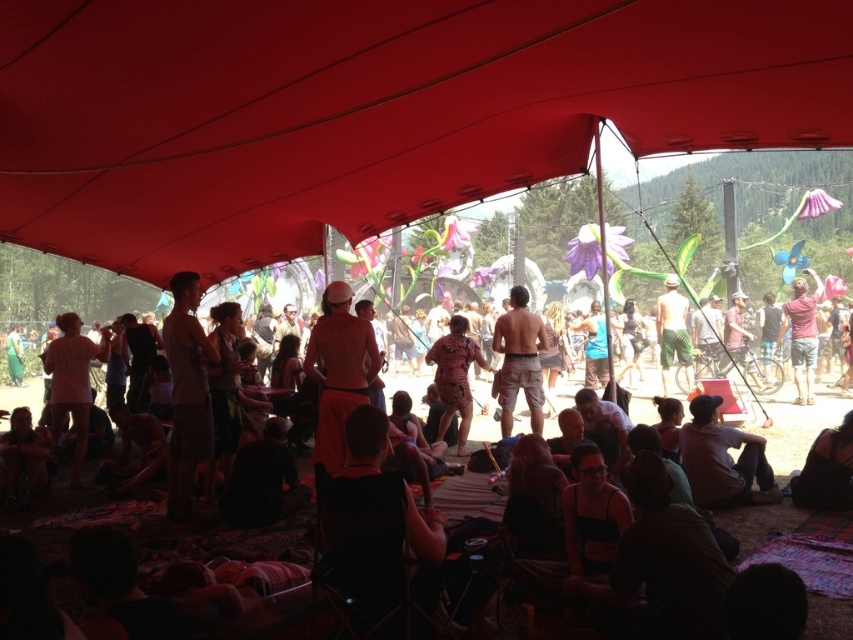
Which of these two, light brown fabric shorts at center or wooden painted figure at center, stands taller?

Standing taller between the two is light brown fabric shorts at center.

Who is more forward, [170,454] or [453,413]?

Point [170,454]

Where is `light brown fabric shorts at center`? light brown fabric shorts at center is located at coordinates (187, 394).

Can you confirm if orange fabric skirt at center is smaller than wooden painted figure at center?

No.

Does point (329, 314) come closer to viewer compared to point (459, 444)?

Yes, point (329, 314) is in front of point (459, 444).

At what (x,y) coordinates should I click in order to perform the action: click on orange fabric skirt at center. Please return your answer as a coordinate pair (x, y). This screenshot has height=640, width=853. Looking at the image, I should click on (338, 371).

Who is lower down, light brown fabric shorts at center or orange fabric skirt at center?

orange fabric skirt at center is below.

Between light brown fabric shorts at center and orange fabric skirt at center, which one has less height?

orange fabric skirt at center is shorter.

The image size is (853, 640). What are the coordinates of `light brown fabric shorts at center` in the screenshot? It's located at (187, 394).